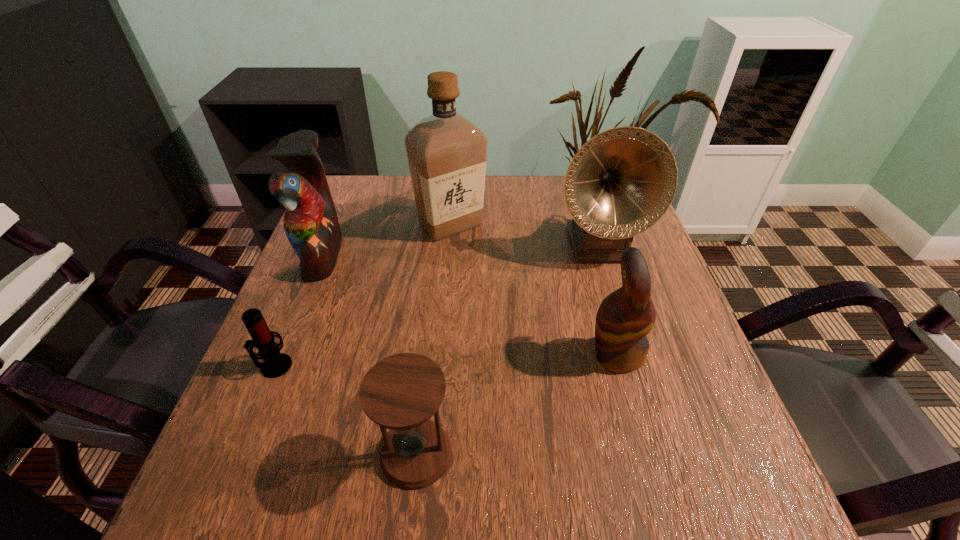
Locate an element on the screen. free location that satisfies the following two spatial constraints: 1. on the horn of the phonograph record; 2. on the face of the right parrot is located at coordinates 632,354.

Identify the location of vacant area that satisfies the following two spatial constraints: 1. on the front-facing side of the tallest object; 2. at the face of the left parrot. (448, 255).

The image size is (960, 540). Find the location of `free space that satisfies the following two spatial constraints: 1. on the horn of the phonograph record; 2. at the face of the left parrot`. free space that satisfies the following two spatial constraints: 1. on the horn of the phonograph record; 2. at the face of the left parrot is located at coordinates (601, 255).